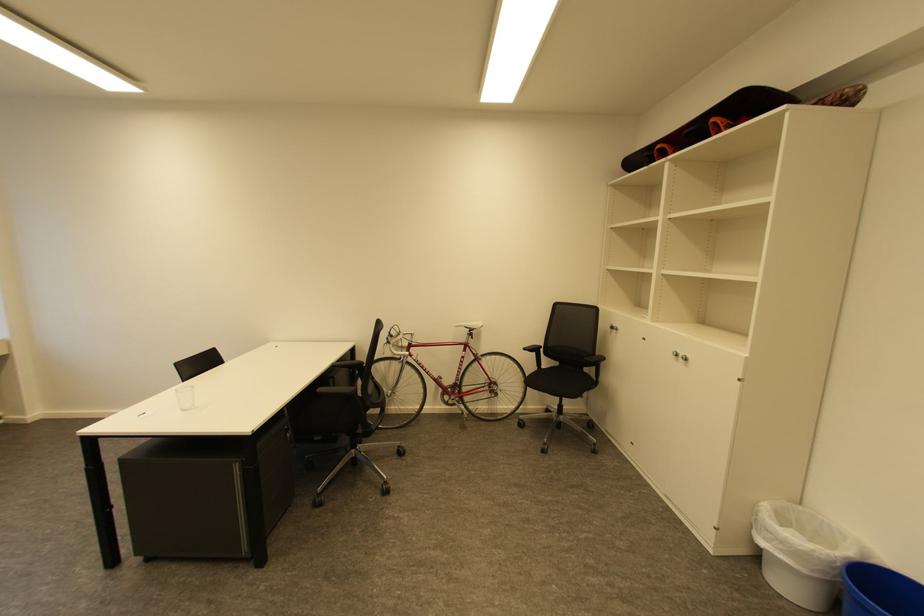
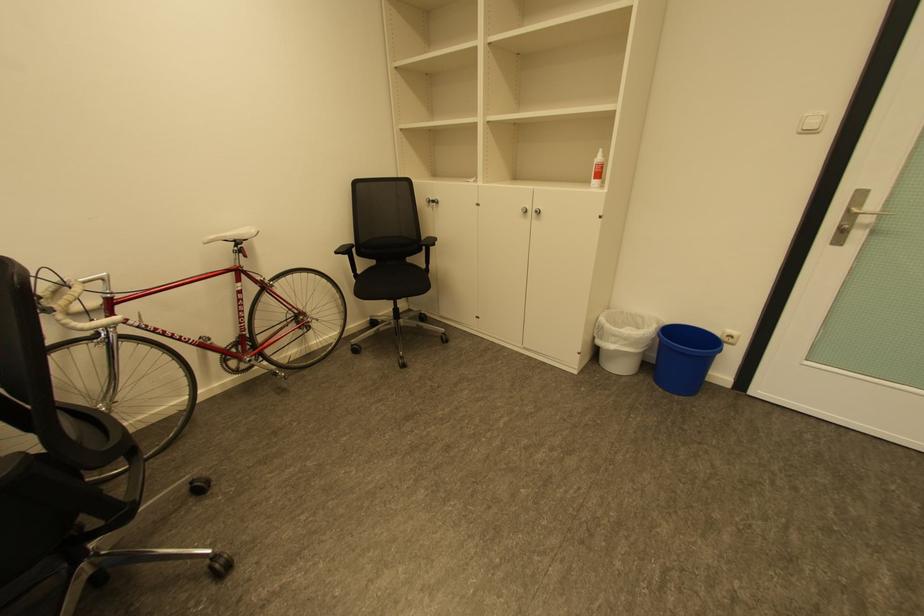
In the second image, find the point that corresponds to the point at 531,350 in the first image.

(344, 253)